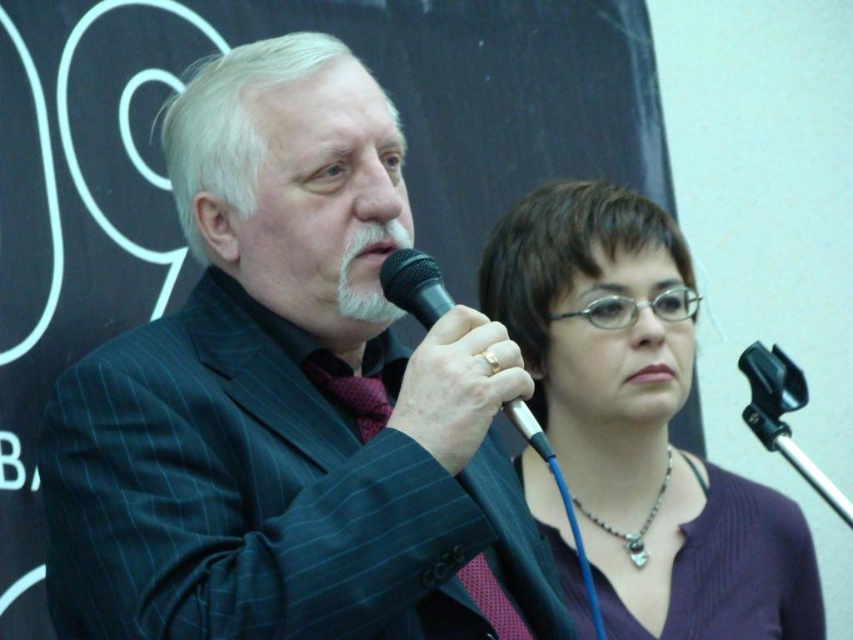
Question: Does black pinstripe suit at center appear under purple knitwear at center?

Choices:
 (A) yes
 (B) no

Answer: (B)

Question: Which point appears closest to the camera in this image?

Choices:
 (A) (514, 412)
 (B) (296, 104)

Answer: (A)

Question: Among these points, which one is farthest from the camera?

Choices:
 (A) (251, 291)
 (B) (502, 237)
 (C) (439, 298)

Answer: (B)

Question: Does black pinstripe suit at center come in front of purple knitwear at center?

Choices:
 (A) yes
 (B) no

Answer: (A)

Question: Which point is farther from the camera taking this photo?

Choices:
 (A) (332, 420)
 (B) (413, 248)

Answer: (B)

Question: Observing the image, what is the correct spatial positioning of black pinstripe suit at center in reference to black plastic microphone at center?

Choices:
 (A) left
 (B) right

Answer: (A)